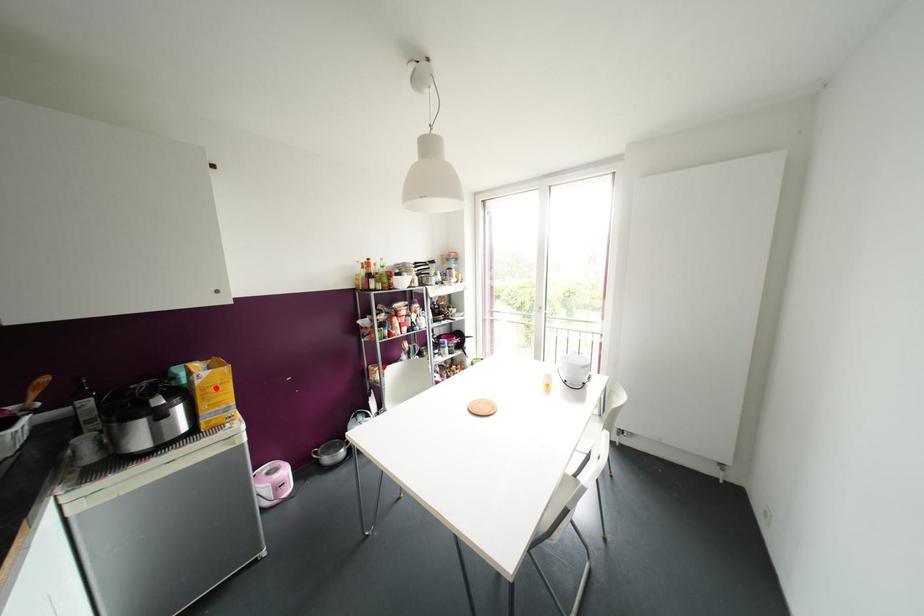
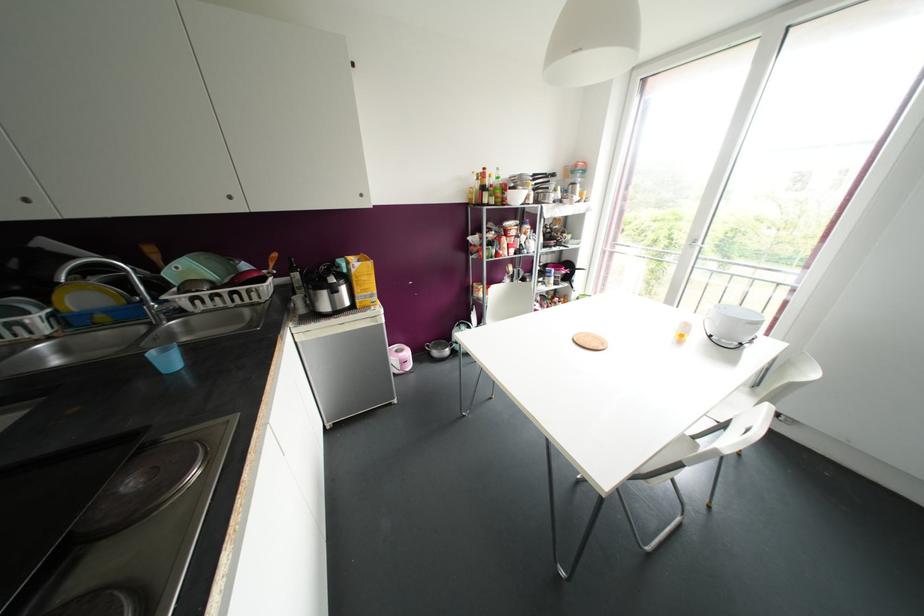
Question: A red point is marked in image1. In image2, is the corresponding 3D point closer to the camera or farther? Reply with the corresponding letter.

Choices:
 (A) The corresponding 3D point is closer.
 (B) The corresponding 3D point is farther.

Answer: (A)